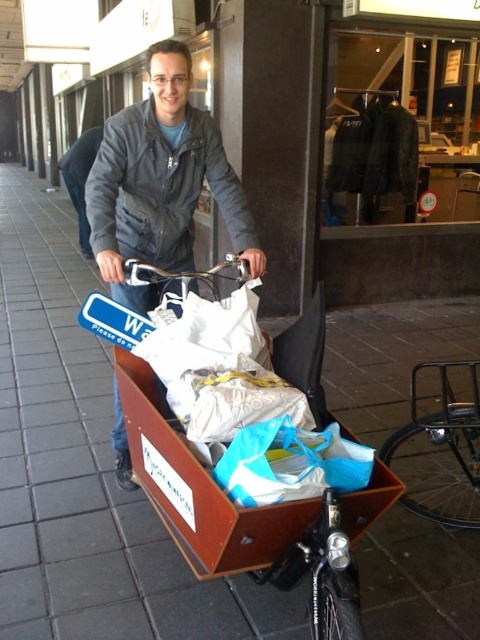
Question: Considering the real-world distances, which object is farthest from the dark gray jacket at center?

Choices:
 (A) matte black jacket at center
 (B) blue plastic bag at center
 (C) metallic silver bicycle at lower right
 (D) brown tile pavement at center

Answer: (B)

Question: Which point is closer to the camera?

Choices:
 (A) blue plastic bag at center
 (B) dark gray jacket at center
 (C) brown tile pavement at center

Answer: (A)

Question: Is brown tile pavement at center thinner than blue plastic bag at center?

Choices:
 (A) yes
 (B) no

Answer: (B)

Question: Which is nearer to the matte black jacket at center?

Choices:
 (A) blue plastic bag at center
 (B) dark gray jacket at center

Answer: (A)

Question: Can you confirm if blue plastic bag at center is positioned to the left of dark gray jacket at center?

Choices:
 (A) no
 (B) yes

Answer: (A)

Question: Can you confirm if metallic silver bicycle at lower right is positioned to the left of blue plastic bag at center?

Choices:
 (A) yes
 (B) no

Answer: (B)